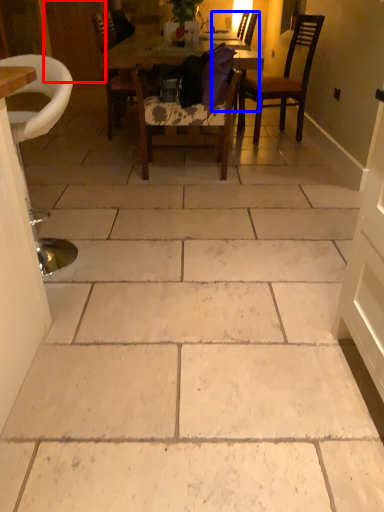
Question: Which of the following is the closest to the observer, door (highlighted by a red box) or chair (highlighted by a blue box)?

Choices:
 (A) door
 (B) chair

Answer: (B)